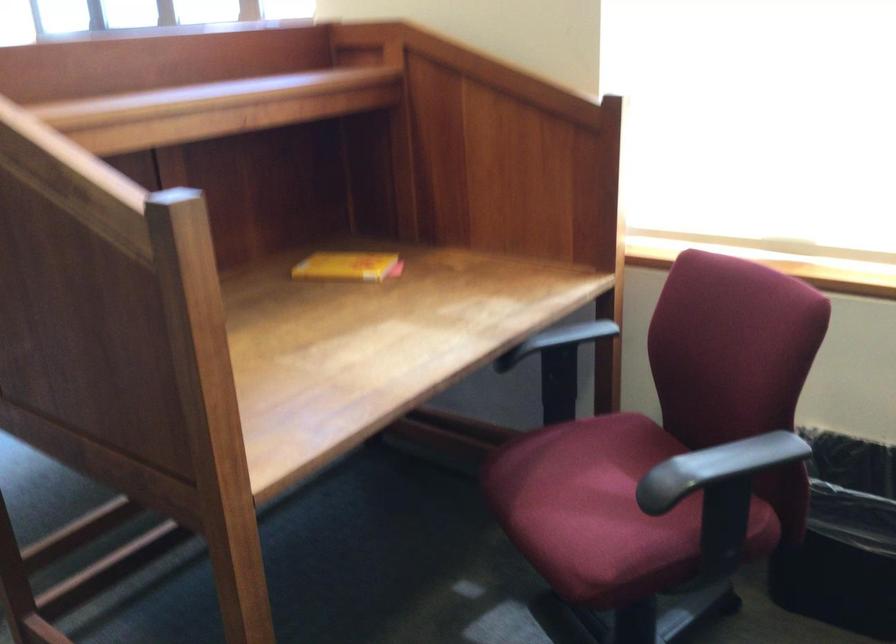
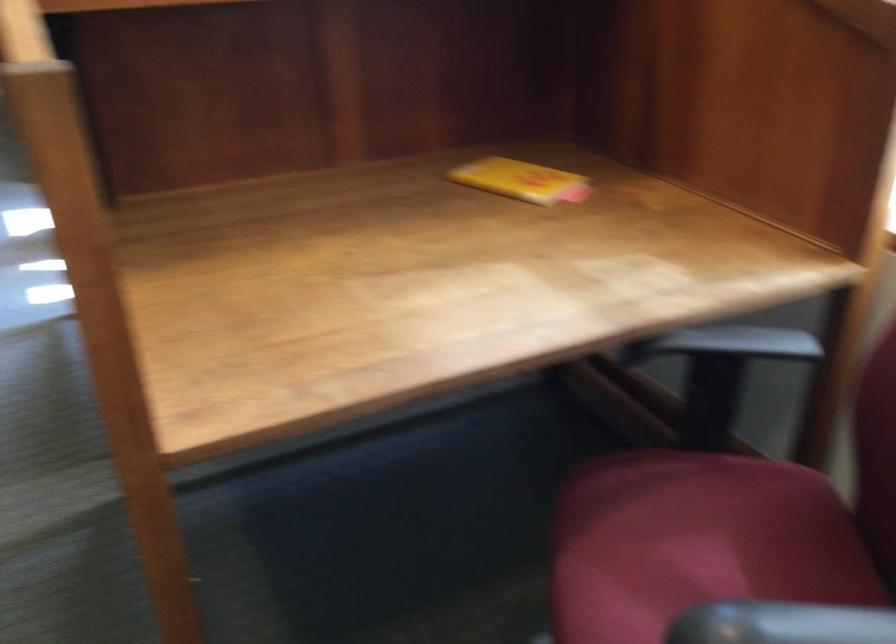
Question: The camera is either moving clockwise (left) or counter-clockwise (right) around the object. The first image is from the beginning of the video and the second image is from the end. Is the camera moving left or right when shooting the video?

Choices:
 (A) Left
 (B) Right

Answer: (B)